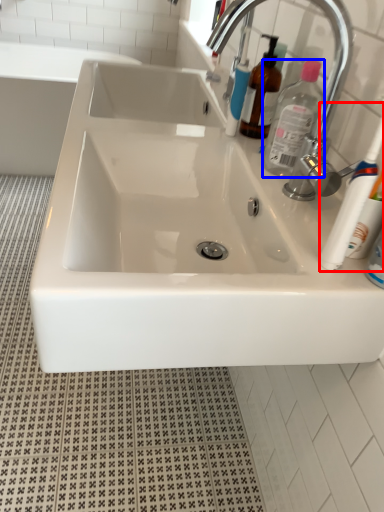
Question: Among these objects, which one is farthest to the camera, toothbrush (highlighted by a red box) or cleaning product (highlighted by a blue box)?

Choices:
 (A) toothbrush
 (B) cleaning product

Answer: (B)